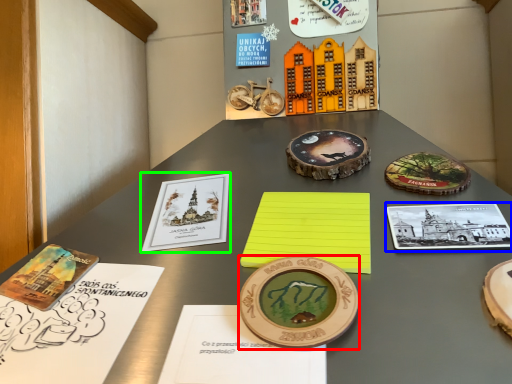
Question: Which is farther away from coin (highlighted by a red box)? book (highlighted by a blue box) or book (highlighted by a green box)?

Choices:
 (A) book
 (B) book

Answer: (B)